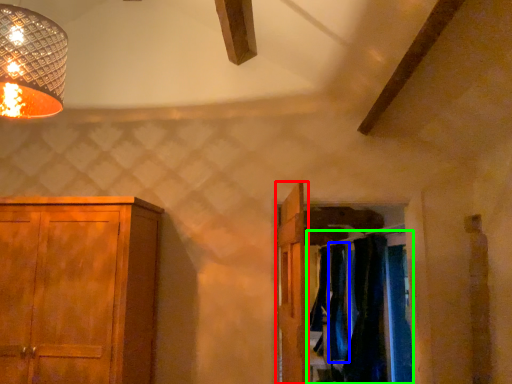
Question: Estimate the real-world distances between objects in this image. Which object is closer to door (highlighted by a red box), curtain (highlighted by a blue box) or laundry (highlighted by a green box)?

Choices:
 (A) curtain
 (B) laundry

Answer: (B)